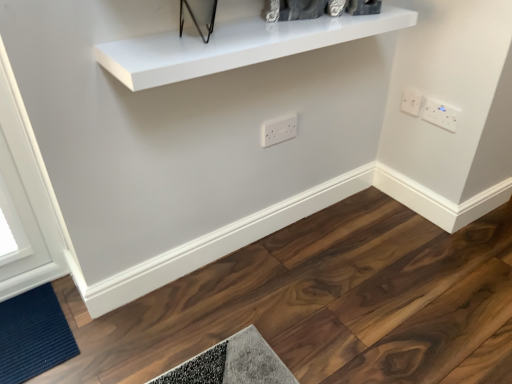
What is the approximate width of white glossy shelf at upper center?

It is 8.90 inches.

What is the approximate height of dark blue textured mat at lower left?

dark blue textured mat at lower left is 4.36 centimeters in height.

Describe the element at coordinates (441, 114) in the screenshot. I see `white plastic electric outlet at upper right, positioned as the 1th electric outlet in right-to-left order` at that location.

In order to face white plastic outlet at center, which is counted as the 1th electric outlet, starting from the left, should I rotate leftwards or rightwards?

Rotate right and turn 3.057 degrees.

Identify the location of white plastic socket at upper right, placed as the 2th electric outlet when sorted from right to left. (412, 101).

Does white plastic outlet at center, which is the 3th electric outlet in right-to-left order, have a greater height compared to white plastic socket at upper right, placed as the 2th electric outlet when sorted from right to left?

Yes.

Is white plastic outlet at center, which is counted as the 1th electric outlet, starting from the left, positioned with its back to white plastic socket at upper right, acting as the 2th electric outlet starting from the left?

That's not correct — white plastic outlet at center, which is counted as the 1th electric outlet, starting from the left, is not looking away from white plastic socket at upper right, acting as the 2th electric outlet starting from the left.

Which electric outlet is the 2nd one when counting from the back of the white plastic outlet at center, which is the 3th electric outlet in right-to-left order? Please provide its 2D coordinates.

[(412, 101)]

From a real-world perspective, is white plastic outlet at center, which is counted as the 1th electric outlet, starting from the left, under white plastic socket at upper right, placed as the 2th electric outlet when sorted from right to left?

Yes, from a real-world perspective, white plastic outlet at center, which is counted as the 1th electric outlet, starting from the left, is under white plastic socket at upper right, placed as the 2th electric outlet when sorted from right to left.

Is white glossy shelf at upper center to the left or to the right of white plastic electric outlet at upper right, positioned as the 1th electric outlet in right-to-left order, in the image?

white glossy shelf at upper center is to the left of white plastic electric outlet at upper right, positioned as the 1th electric outlet in right-to-left order.

Could white plastic electric outlet at upper right, positioned as the 1th electric outlet in right-to-left order, be considered to be inside white glossy shelf at upper center?

Definitely not — white plastic electric outlet at upper right, positioned as the 1th electric outlet in right-to-left order, is not inside white glossy shelf at upper center.

Who is smaller, white glossy shelf at upper center or white plastic electric outlet at upper right, positioned as the 1th electric outlet in right-to-left order?

Smaller between the two is white plastic electric outlet at upper right, positioned as the 1th electric outlet in right-to-left order.

Which object is closer to the camera, white glossy shelf at upper center or white plastic electric outlet at upper right, positioned as the 1th electric outlet in right-to-left order?

white glossy shelf at upper center is more forward.

From the picture: Which object is positioned more to the right, dark blue textured mat at lower left or white plastic electric outlet at upper right, which ranks as the 3th electric outlet in left-to-right order?

white plastic electric outlet at upper right, which ranks as the 3th electric outlet in left-to-right order.

Do you think dark blue textured mat at lower left is within white plastic electric outlet at upper right, which ranks as the 3th electric outlet in left-to-right order, or outside of it?

dark blue textured mat at lower left lies outside white plastic electric outlet at upper right, which ranks as the 3th electric outlet in left-to-right order.

Is dark blue textured mat at lower left touching white plastic electric outlet at upper right, positioned as the 1th electric outlet in right-to-left order?

No, dark blue textured mat at lower left is not in contact with white plastic electric outlet at upper right, positioned as the 1th electric outlet in right-to-left order.

Considering the relative positions of dark blue textured mat at lower left and white plastic electric outlet at upper right, positioned as the 1th electric outlet in right-to-left order, in the image provided, is dark blue textured mat at lower left behind white plastic electric outlet at upper right, positioned as the 1th electric outlet in right-to-left order,?

No.

From a real-world perspective, is white plastic electric outlet at upper right, positioned as the 1th electric outlet in right-to-left order, over dark blue textured mat at lower left?

Correct, in the physical world, white plastic electric outlet at upper right, positioned as the 1th electric outlet in right-to-left order, is higher than dark blue textured mat at lower left.

Who is smaller, white plastic electric outlet at upper right, which ranks as the 3th electric outlet in left-to-right order, or dark blue textured mat at lower left?

white plastic electric outlet at upper right, which ranks as the 3th electric outlet in left-to-right order.

Between point (456, 123) and point (17, 310), which one is positioned in front?

The point (17, 310) is more forward.

Can you confirm if white plastic electric outlet at upper right, which ranks as the 3th electric outlet in left-to-right order, is positioned to the right of dark blue textured mat at lower left?

Yes, white plastic electric outlet at upper right, which ranks as the 3th electric outlet in left-to-right order, is to the right of dark blue textured mat at lower left.

Considering the relative positions of dark blue textured mat at lower left and white glossy shelf at upper center in the image provided, is dark blue textured mat at lower left to the left or to the right of white glossy shelf at upper center?

From the image, it's evident that dark blue textured mat at lower left is to the left of white glossy shelf at upper center.

Is dark blue textured mat at lower left turned away from white glossy shelf at upper center?

No.

Would you consider dark blue textured mat at lower left to be distant from white glossy shelf at upper center?

No, dark blue textured mat at lower left is not far away from white glossy shelf at upper center.

Is point (46, 299) closer or farther from the camera than point (190, 57)?

Point (46, 299).

Does white plastic outlet at center, which is counted as the 1th electric outlet, starting from the left, contain white glossy shelf at upper center?

No, white glossy shelf at upper center is not surrounded by white plastic outlet at center, which is counted as the 1th electric outlet, starting from the left.

From a real-world perspective, who is located higher, white plastic outlet at center, which is counted as the 1th electric outlet, starting from the left, or white glossy shelf at upper center?

In real-world perspective, white glossy shelf at upper center is above.

Does white plastic outlet at center, which is counted as the 1th electric outlet, starting from the left, touch white glossy shelf at upper center?

white plastic outlet at center, which is counted as the 1th electric outlet, starting from the left, is not next to white glossy shelf at upper center, and they're not touching.

From the image's perspective, is white plastic outlet at center, which is counted as the 1th electric outlet, starting from the left, on top of white glossy shelf at upper center?

No.

Which is correct: white plastic electric outlet at upper right, which ranks as the 3th electric outlet in left-to-right order, is inside white glossy shelf at upper center, or outside of it?

white plastic electric outlet at upper right, which ranks as the 3th electric outlet in left-to-right order, is located beyond the bounds of white glossy shelf at upper center.

Which of these two, white plastic electric outlet at upper right, positioned as the 1th electric outlet in right-to-left order, or white glossy shelf at upper center, is wider?

With larger width is white glossy shelf at upper center.

How different are the orientations of white plastic electric outlet at upper right, which ranks as the 3th electric outlet in left-to-right order, and white glossy shelf at upper center in degrees?

There is a 93-degree angle between the facing directions of white plastic electric outlet at upper right, which ranks as the 3th electric outlet in left-to-right order, and white glossy shelf at upper center.

Consider the image. Which of these two, white plastic electric outlet at upper right, positioned as the 1th electric outlet in right-to-left order, or white glossy shelf at upper center, is smaller?

With smaller size is white plastic electric outlet at upper right, positioned as the 1th electric outlet in right-to-left order.

Locate an element on the screen. The width and height of the screenshot is (512, 384). the 2nd electric outlet positioned below the white plastic socket at upper right, acting as the 2th electric outlet starting from the left (from the image's perspective) is located at coordinates (278, 129).

This screenshot has height=384, width=512. Identify the location of the 1st electric outlet positioned below the white glossy shelf at upper center (from a real-world perspective). (441, 114).

Estimate the real-world distances between objects in this image. Which object is further from white glossy shelf at upper center, white plastic socket at upper right, placed as the 2th electric outlet when sorted from right to left, or dark blue textured mat at lower left?

dark blue textured mat at lower left is positioned further to the anchor white glossy shelf at upper center.

Considering their positions, is white plastic outlet at center, which is the 3th electric outlet in right-to-left order, positioned further to white glossy shelf at upper center than dark blue textured mat at lower left?

Based on the image, dark blue textured mat at lower left appears to be further to white glossy shelf at upper center.

Looking at this image, looking at the image, which one is located closer to white plastic socket at upper right, placed as the 2th electric outlet when sorted from right to left, white glossy shelf at upper center or white plastic outlet at center, which is the 3th electric outlet in right-to-left order?

white plastic outlet at center, which is the 3th electric outlet in right-to-left order, is closer to white plastic socket at upper right, placed as the 2th electric outlet when sorted from right to left.

When comparing their distances from dark blue textured mat at lower left, does white plastic socket at upper right, placed as the 2th electric outlet when sorted from right to left, or white plastic outlet at center, which is the 3th electric outlet in right-to-left order, seem further?

Based on the image, white plastic socket at upper right, placed as the 2th electric outlet when sorted from right to left, appears to be further to dark blue textured mat at lower left.

Based on the photo, from the image, which object appears to be nearer to white plastic outlet at center, which is the 3th electric outlet in right-to-left order, white plastic socket at upper right, acting as the 2th electric outlet starting from the left, or white glossy shelf at upper center?

Based on the image, white glossy shelf at upper center appears to be nearer to white plastic outlet at center, which is the 3th electric outlet in right-to-left order.

Looking at the image, which one is located closer to dark blue textured mat at lower left, white plastic socket at upper right, placed as the 2th electric outlet when sorted from right to left, or white plastic electric outlet at upper right, positioned as the 1th electric outlet in right-to-left order?

white plastic socket at upper right, placed as the 2th electric outlet when sorted from right to left, lies closer to dark blue textured mat at lower left than the other object.

Looking at the image, which one is located further to white glossy shelf at upper center, white plastic socket at upper right, placed as the 2th electric outlet when sorted from right to left, or white plastic outlet at center, which is the 3th electric outlet in right-to-left order?

white plastic socket at upper right, placed as the 2th electric outlet when sorted from right to left, lies further to white glossy shelf at upper center than the other object.

Based on their spatial positions, is white plastic electric outlet at upper right, positioned as the 1th electric outlet in right-to-left order, or dark blue textured mat at lower left further from white glossy shelf at upper center?

Based on the image, dark blue textured mat at lower left appears to be further to white glossy shelf at upper center.

Identify the location of shelf between dark blue textured mat at lower left and white plastic socket at upper right, acting as the 2th electric outlet starting from the left, from left to right. This screenshot has width=512, height=384. (234, 46).

Find the location of `electric outlet located between white plastic outlet at center, which is counted as the 1th electric outlet, starting from the left, and white plastic electric outlet at upper right, which ranks as the 3th electric outlet in left-to-right order, in the left-right direction`. electric outlet located between white plastic outlet at center, which is counted as the 1th electric outlet, starting from the left, and white plastic electric outlet at upper right, which ranks as the 3th electric outlet in left-to-right order, in the left-right direction is located at coordinates (412, 101).

In order to click on shelf situated between dark blue textured mat at lower left and white plastic outlet at center, which is counted as the 1th electric outlet, starting from the left, from left to right in this screenshot , I will do `click(234, 46)`.

What are the coordinates of `electric outlet between white glossy shelf at upper center and white plastic electric outlet at upper right, which ranks as the 3th electric outlet in left-to-right order, from front to back` in the screenshot? It's located at (278, 129).